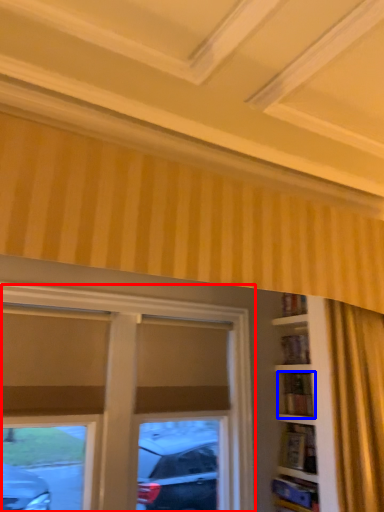
Question: Which object appears closest to the camera in this image, window (highlighted by a red box) or shelf (highlighted by a blue box)?

Choices:
 (A) window
 (B) shelf

Answer: (A)